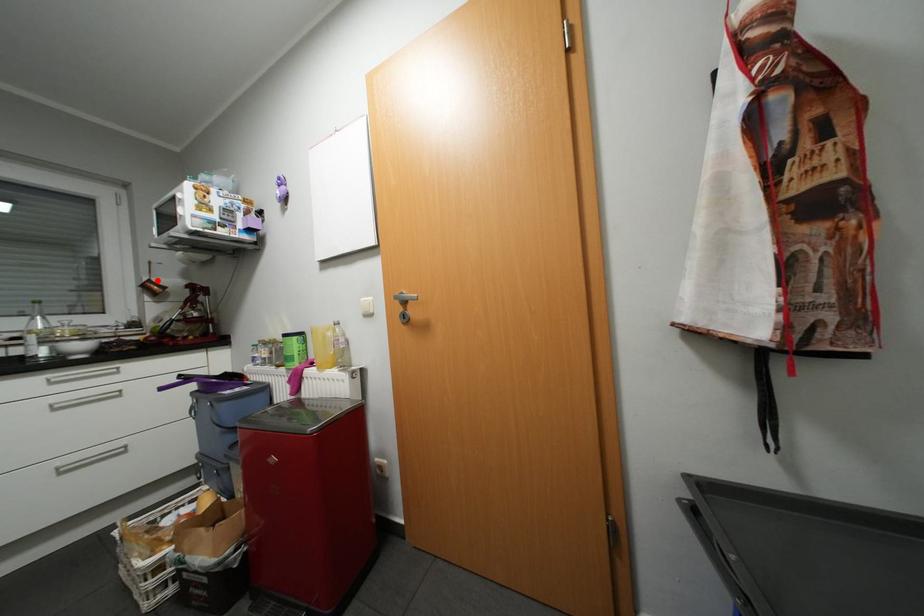
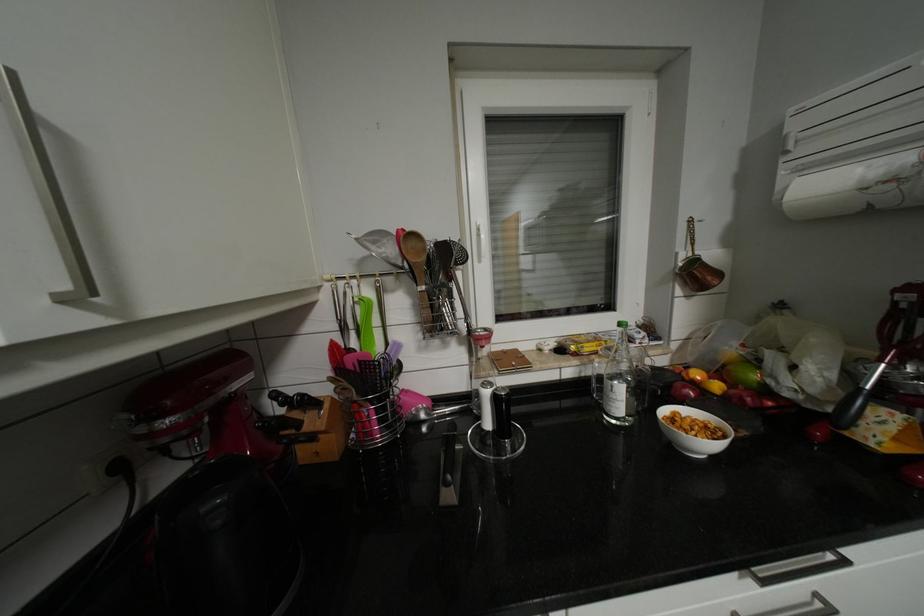
Find the pixel in the second image that matches the highlighted location in the first image.

(702, 261)